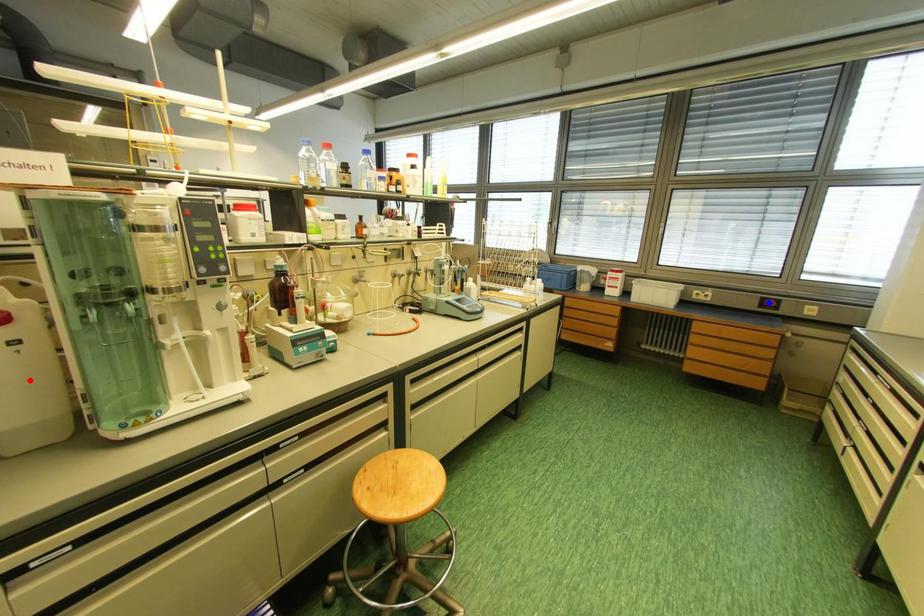
Question: In the image, two points are highlighted. Which point is nearer to the camera? Reply with the corresponding letter.

Choices:
 (A) blue point
 (B) red point

Answer: (B)